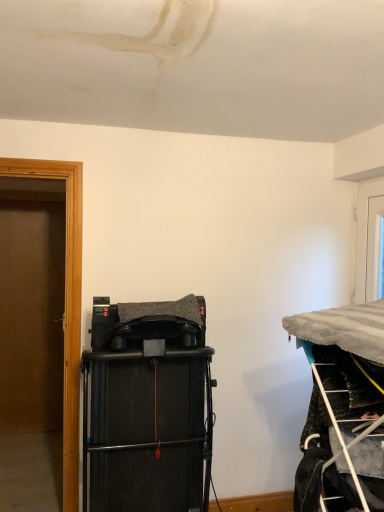
Question: Is white plastic ladder at lower right positioned before black matte speaker at center?

Choices:
 (A) no
 (B) yes

Answer: (B)

Question: Considering the relative sizes of white plastic ladder at lower right and black matte speaker at center in the image provided, is white plastic ladder at lower right wider than black matte speaker at center?

Choices:
 (A) no
 (B) yes

Answer: (A)

Question: From a real-world perspective, is white plastic ladder at lower right located higher than black matte speaker at center?

Choices:
 (A) no
 (B) yes

Answer: (B)

Question: Can you confirm if white plastic ladder at lower right is smaller than black matte speaker at center?

Choices:
 (A) no
 (B) yes

Answer: (B)

Question: From the image's perspective, does white plastic ladder at lower right appear higher than black matte speaker at center?

Choices:
 (A) no
 (B) yes

Answer: (B)

Question: Considering the positions of metallic wire rack at right and black matte speaker at center in the image, is metallic wire rack at right bigger or smaller than black matte speaker at center?

Choices:
 (A) big
 (B) small

Answer: (B)

Question: Which is correct: metallic wire rack at right is inside black matte speaker at center, or outside of it?

Choices:
 (A) inside
 (B) outside

Answer: (B)

Question: Relative to black matte speaker at center, is metallic wire rack at right in front or behind?

Choices:
 (A) front
 (B) behind

Answer: (A)

Question: Considering the positions of metallic wire rack at right and black matte speaker at center in the image, is metallic wire rack at right taller or shorter than black matte speaker at center?

Choices:
 (A) short
 (B) tall

Answer: (A)

Question: In terms of size, does white glossy door at upper right appear bigger or smaller than white plastic ladder at lower right?

Choices:
 (A) small
 (B) big

Answer: (A)

Question: Considering the positions of white glossy door at upper right and white plastic ladder at lower right in the image, is white glossy door at upper right wider or thinner than white plastic ladder at lower right?

Choices:
 (A) thin
 (B) wide

Answer: (A)

Question: Does point (360, 229) appear closer or farther from the camera than point (334, 419)?

Choices:
 (A) farther
 (B) closer

Answer: (A)

Question: From a real-world perspective, is white glossy door at upper right above or below white plastic ladder at lower right?

Choices:
 (A) above
 (B) below

Answer: (A)

Question: Considering the positions of white plastic ladder at lower right and black matte speaker at center in the image, is white plastic ladder at lower right taller or shorter than black matte speaker at center?

Choices:
 (A) tall
 (B) short

Answer: (B)

Question: Choose the correct answer: Is white plastic ladder at lower right inside black matte speaker at center or outside it?

Choices:
 (A) outside
 (B) inside

Answer: (A)